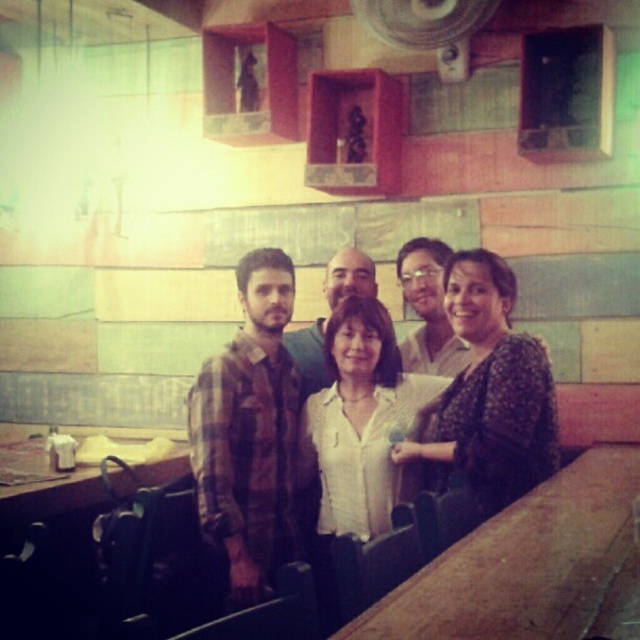
Can you confirm if plaid fabric shirt at center is positioned to the left of white matte shirt at center?

Indeed, plaid fabric shirt at center is positioned on the left side of white matte shirt at center.

Does point (227, 448) lie in front of point (349, 429)?

Yes.

Find the location of `plaid fabric shirt at center`. plaid fabric shirt at center is located at coordinates (250, 433).

Which of these two, plaid fabric shirt at center or white cotton shirt at center, stands taller?

plaid fabric shirt at center is taller.

Can you confirm if plaid fabric shirt at center is thinner than white cotton shirt at center?

Correct, plaid fabric shirt at center's width is less than white cotton shirt at center's.

Image resolution: width=640 pixels, height=640 pixels. What do you see at coordinates (250, 433) in the screenshot? I see `plaid fabric shirt at center` at bounding box center [250, 433].

I want to click on plaid fabric shirt at center, so click(x=250, y=433).

Between white matte shirt at center and white cotton shirt at center, which one has less height?

white matte shirt at center is shorter.

The image size is (640, 640). Describe the element at coordinates (356, 429) in the screenshot. I see `white matte shirt at center` at that location.

The width and height of the screenshot is (640, 640). In order to click on white matte shirt at center in this screenshot , I will do `click(356, 429)`.